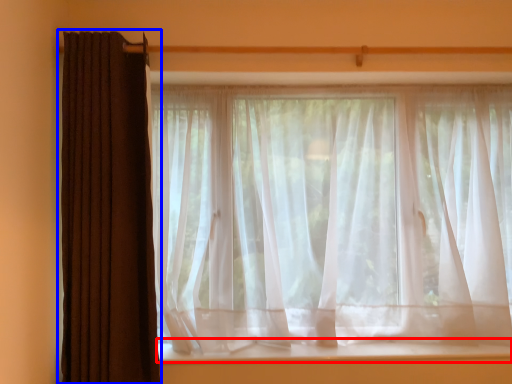
Question: Which object appears farthest to the camera in this image, window sill (highlighted by a red box) or curtain (highlighted by a blue box)?

Choices:
 (A) window sill
 (B) curtain

Answer: (A)